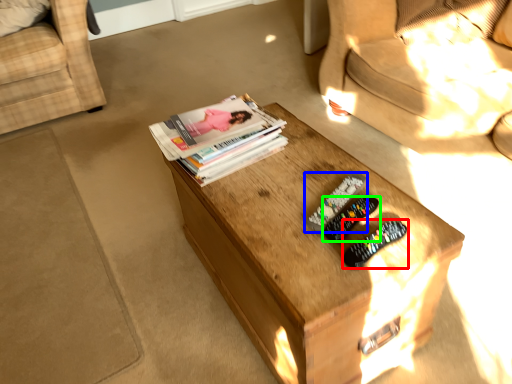
Question: Which object is positioned farthest from remote control (highlighted by a red box)? Select from remote control (highlighted by a blue box) and remote control (highlighted by a green box).

Choices:
 (A) remote control
 (B) remote control

Answer: (A)